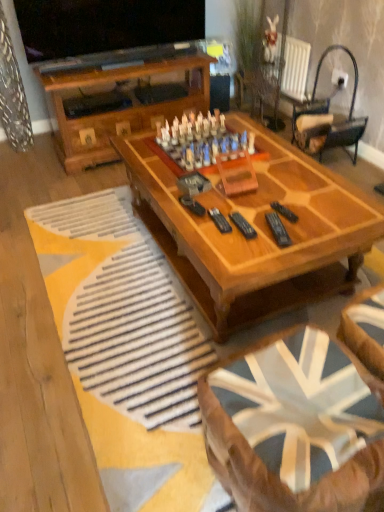
Identify the location of vacant space behind black plastic remote at center, which is the 2th remote in left-to-right order. (266, 207).